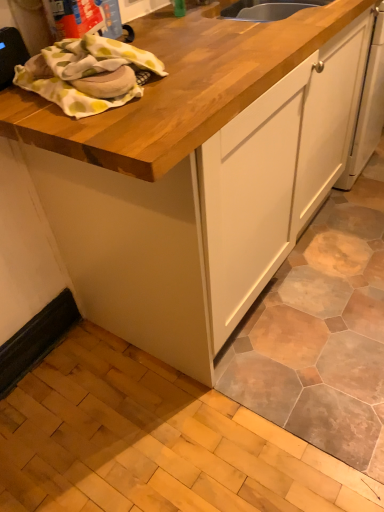
You are a GUI agent. You are given a task and a screenshot of the screen. Output one action in this format:
    pyautogui.click(x=<x>, y=<y>)
    Task: Click on the free location to the right of yellow-green polka dot fabric at upper left
    
    Given the screenshot: What is the action you would take?
    pyautogui.click(x=226, y=57)